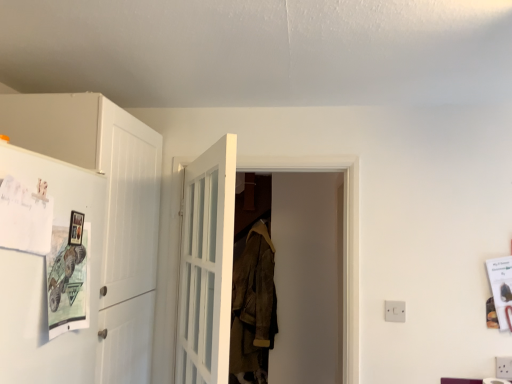
Question: From the image's perspective, is white glass door at center, the first door positioned from the front, on leather jacket at center?

Choices:
 (A) yes
 (B) no

Answer: (A)

Question: Is white glass door at center, the first door positioned from the front, further to camera compared to leather jacket at center?

Choices:
 (A) no
 (B) yes

Answer: (A)

Question: Does white glass door at center, the 2th door viewed from the back, touch leather jacket at center?

Choices:
 (A) no
 (B) yes

Answer: (A)

Question: Can you confirm if white glass door at center, the first door positioned from the front, is positioned to the right of leather jacket at center?

Choices:
 (A) yes
 (B) no

Answer: (B)

Question: From a real-world perspective, is white glass door at center, the first door positioned from the front, physically below leather jacket at center?

Choices:
 (A) yes
 (B) no

Answer: (B)

Question: From a real-world perspective, is white glass door at center, the 2th door viewed from the back, on leather jacket at center?

Choices:
 (A) no
 (B) yes

Answer: (B)

Question: Can you see white glass door at center, the first door positioned from the front, touching white plastic electric outlet at lower right?

Choices:
 (A) yes
 (B) no

Answer: (B)

Question: Can you confirm if white glass door at center, the 2th door viewed from the back, is smaller than white plastic electric outlet at lower right?

Choices:
 (A) yes
 (B) no

Answer: (B)

Question: Does white glass door at center, the first door positioned from the front, have a greater height compared to white plastic electric outlet at lower right?

Choices:
 (A) yes
 (B) no

Answer: (A)

Question: Does white glass door at center, the first door positioned from the front, have a lesser height compared to white plastic electric outlet at lower right?

Choices:
 (A) no
 (B) yes

Answer: (A)

Question: From the image's perspective, is white glass door at center, the 2th door viewed from the back, above white plastic electric outlet at lower right?

Choices:
 (A) no
 (B) yes

Answer: (B)

Question: Considering the relative positions of white glass door at center, the 2th door viewed from the back, and white plastic electric outlet at lower right in the image provided, is white glass door at center, the 2th door viewed from the back, to the left of white plastic electric outlet at lower right from the viewer's perspective?

Choices:
 (A) no
 (B) yes

Answer: (B)

Question: Does white matte refrigerator at left have a larger size compared to leather jacket at center?

Choices:
 (A) no
 (B) yes

Answer: (B)